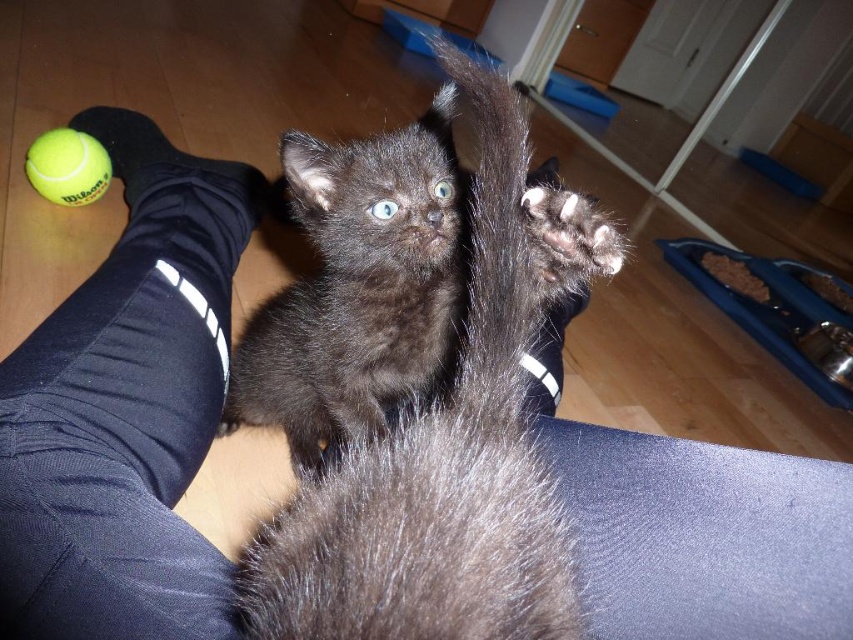
Which is behind, point (302, 577) or point (90, 192)?

The point (90, 192) is behind.

In the scene shown: Which is more to the right, black fur cat at center or green rubber tennis ball at lower left?

From the viewer's perspective, black fur cat at center appears more on the right side.

Who is more distant from viewer, (531, 566) or (57, 147)?

Point (57, 147)

Where is `black fur cat at center`? black fur cat at center is located at coordinates (437, 472).